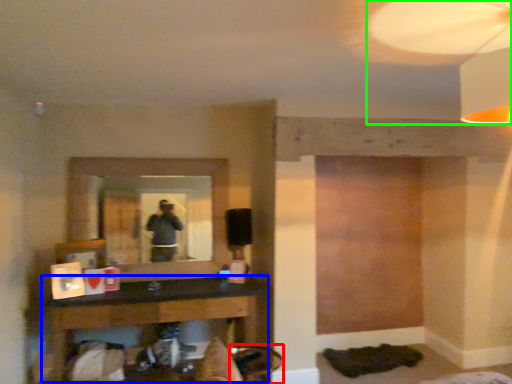
Question: Which object is positioned farthest from swivel chair (highlighted by a red box)? Select from table (highlighted by a blue box) and mechanical fan (highlighted by a green box).

Choices:
 (A) table
 (B) mechanical fan

Answer: (B)